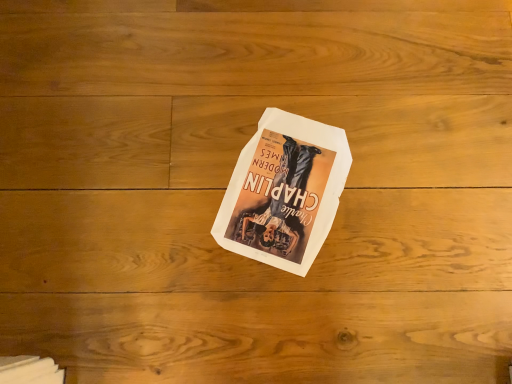
Where is `free space in front of white paper at center`? The width and height of the screenshot is (512, 384). free space in front of white paper at center is located at coordinates (287, 313).